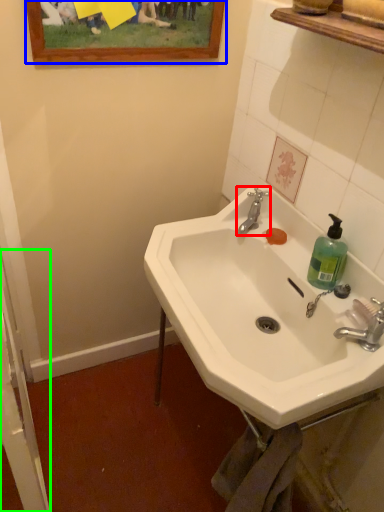
Question: Which object is the closest to the tap (highlighted by a red box)? Choose among these: picture frame (highlighted by a blue box) or screen door (highlighted by a green box).

Choices:
 (A) picture frame
 (B) screen door

Answer: (A)